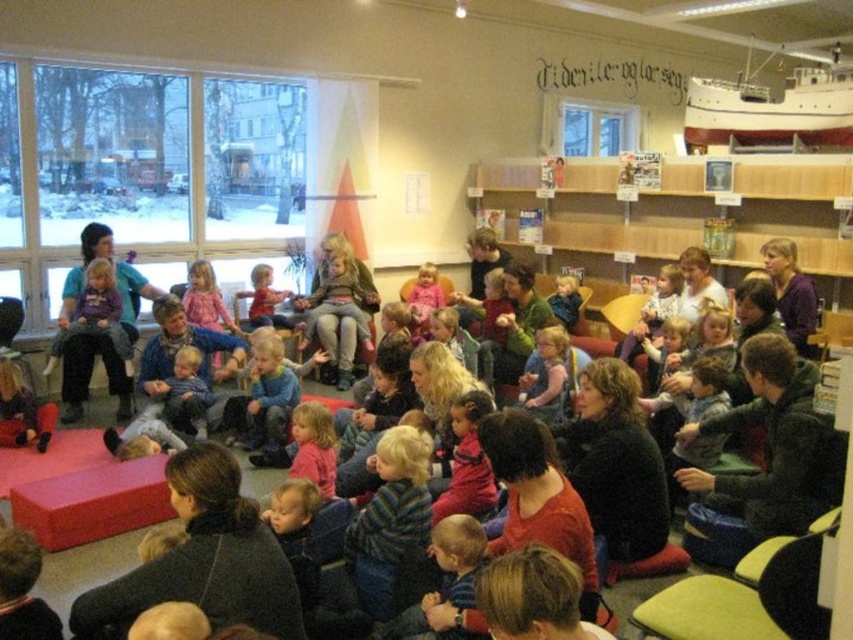
Question: Is black matte jacket at center in front of blue denim pants at center?

Choices:
 (A) no
 (B) yes

Answer: (B)

Question: Which point appears farthest from the camera in this image?

Choices:
 (A) [x=811, y=388]
 (B) [x=173, y=365]
 (C) [x=547, y=332]

Answer: (B)

Question: Where is dark green sweater at lower right located in relation to blue denim pants at center in the image?

Choices:
 (A) left
 (B) right

Answer: (B)

Question: Does matte pink sweater at center appear over blue denim pants at center?

Choices:
 (A) no
 (B) yes

Answer: (B)

Question: Based on their relative distances, which object is nearer to the dark green sweater at lower right?

Choices:
 (A) matte pink sweater at center
 (B) blue denim pants at center
 (C) black matte jacket at center

Answer: (C)

Question: Which point is closer to the camera taking this photo?

Choices:
 (A) (519, 387)
 (B) (635, 424)
 (C) (759, 406)

Answer: (B)